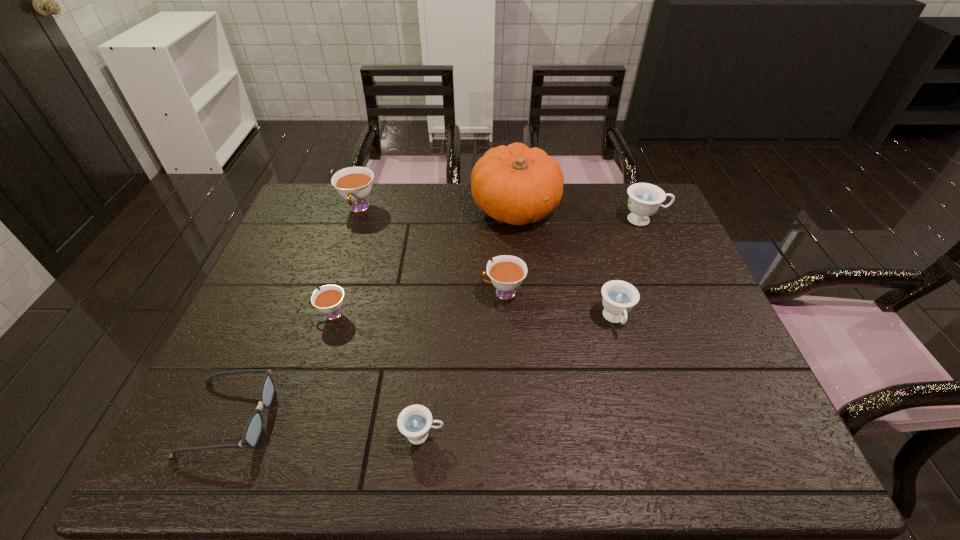
Find the location of a particular element. This screenshot has width=960, height=540. free region located on the side of the smallest white teacup with the handle is located at coordinates (260, 314).

Locate an element on the screen. This screenshot has width=960, height=540. vacant space located 0.090m on the side of the smallest white teacup with the handle is located at coordinates (279, 314).

The image size is (960, 540). Find the location of `free spot located on the side of the smallest blue teacup with the handle`. free spot located on the side of the smallest blue teacup with the handle is located at coordinates (610, 435).

Where is `free space located on the face of the gray spectacles`? free space located on the face of the gray spectacles is located at coordinates (349, 417).

Where is `pumpkin that is at the far edge`? This screenshot has height=540, width=960. pumpkin that is at the far edge is located at coordinates (515, 184).

Find the location of `teacup positioned at the near edge`. teacup positioned at the near edge is located at coordinates (414, 422).

Image resolution: width=960 pixels, height=540 pixels. What are the coordinates of `spectacles that is at the near edge` in the screenshot? It's located at (254, 426).

This screenshot has width=960, height=540. In order to click on teacup that is at the left edge in this screenshot , I will do `click(354, 184)`.

Locate an element on the screen. This screenshot has width=960, height=540. spectacles located in the left edge section of the desktop is located at coordinates tap(254, 426).

Locate an element on the screen. The height and width of the screenshot is (540, 960). object at the right edge is located at coordinates (644, 199).